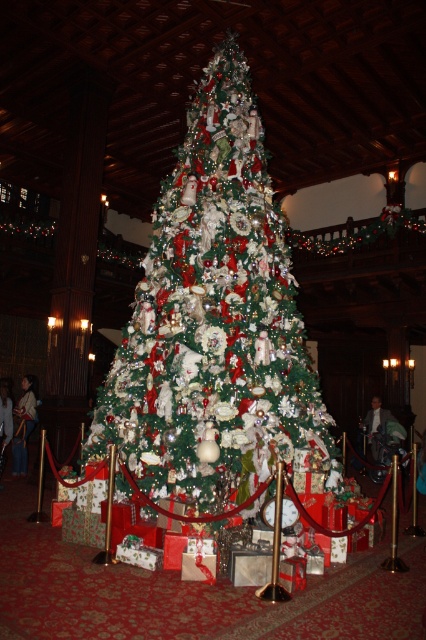
In the scene shown: You are attending a Christmas party and see a light brown leather jacket at lower left and a white fabric dress at center. Which item is positioned closer to the bottom of the image?

The light brown leather jacket at lower left is located below the white fabric dress at center, so it is closer to the bottom of the image.

You are at a Christmas party and see two outfits displayed at the center of the room near the tree. The white fabric dress at center and the green velvet suit at center. Which outfit is closer to you?

The white fabric dress at center is closer to you because it is in front of the green velvet suit at center.